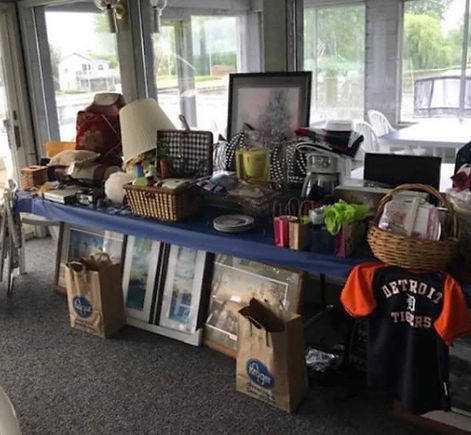
Where is `table`? This screenshot has width=471, height=435. table is located at coordinates (260, 250), (161, 231), (86, 215).